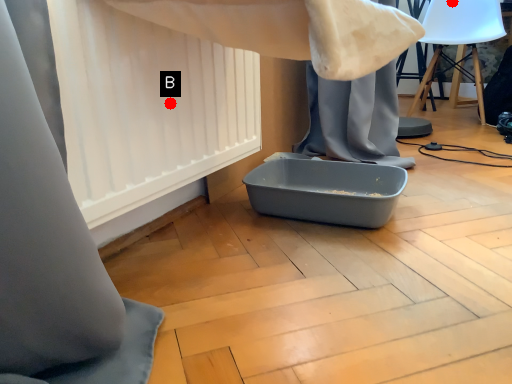
Question: Two points are circled on the image, labeled by A and B beside each circle. Which point is further to the camera?

Choices:
 (A) A is further
 (B) B is further

Answer: (A)